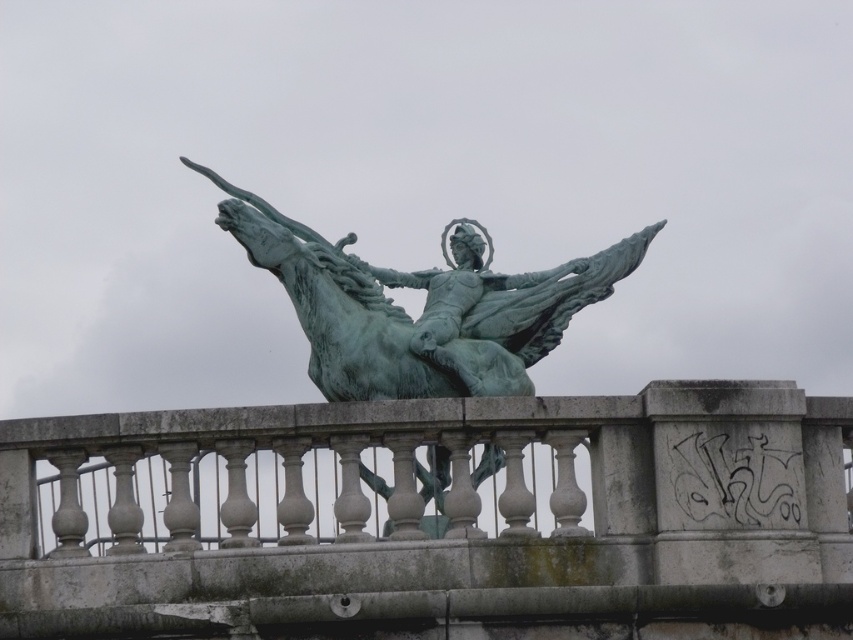
Is green stone railing at center to the left of green patina statue at center from the viewer's perspective?

No, green stone railing at center is not to the left of green patina statue at center.

Is point (640, 492) positioned before point (424, 364)?

Yes.

In order to click on green stone railing at center in this screenshot , I will do `click(436, 518)`.